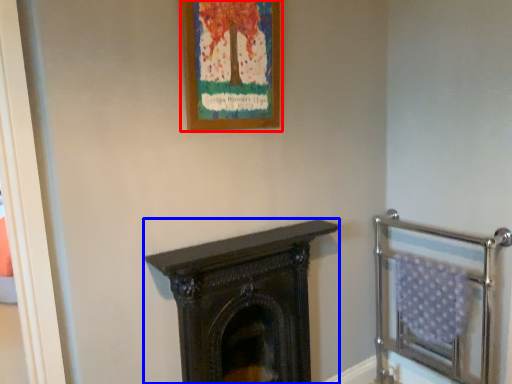
Question: Which point is closer to the camera, picture frame (highlighted by a red box) or fireplace (highlighted by a blue box)?

Choices:
 (A) picture frame
 (B) fireplace

Answer: (A)